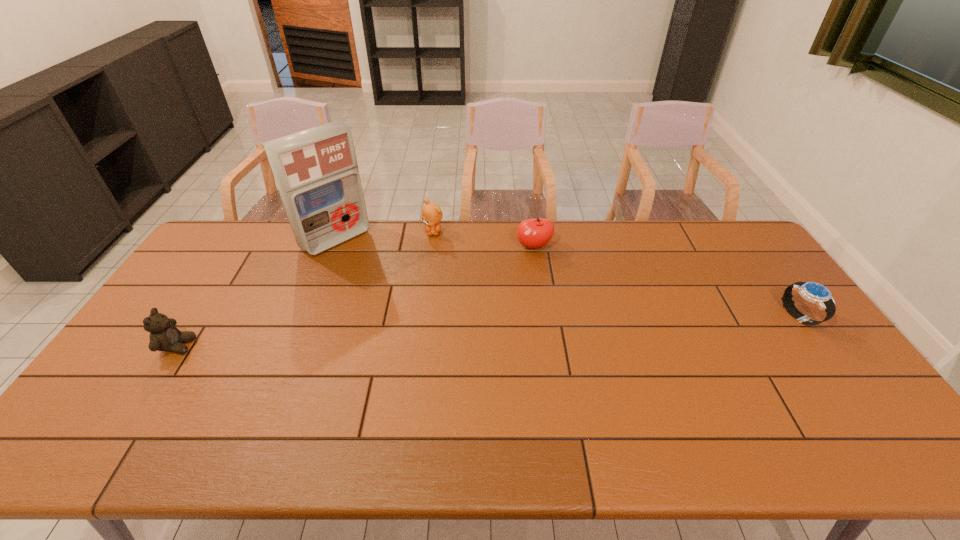
The height and width of the screenshot is (540, 960). Find the location of `the nearer teddy bear`. the nearer teddy bear is located at coordinates (164, 336).

Identify the location of the leftmost object. (164, 336).

Where is `the shortest object`? The image size is (960, 540). the shortest object is located at coordinates (813, 292).

Find the location of a particular element. The image size is (960, 540). watch is located at coordinates (813, 292).

I want to click on the fourth object from left to right, so click(x=533, y=233).

Locate an element on the screen. the right teddy bear is located at coordinates (431, 213).

Find the location of `the third object from right to left`. the third object from right to left is located at coordinates (431, 213).

This screenshot has width=960, height=540. In order to click on the first-aid kit in this screenshot , I will do `click(316, 171)`.

Where is `the second object from left to right`? The image size is (960, 540). the second object from left to right is located at coordinates (316, 171).

What are the coordinates of `free point located on the face of the leftmost object` in the screenshot? It's located at (223, 346).